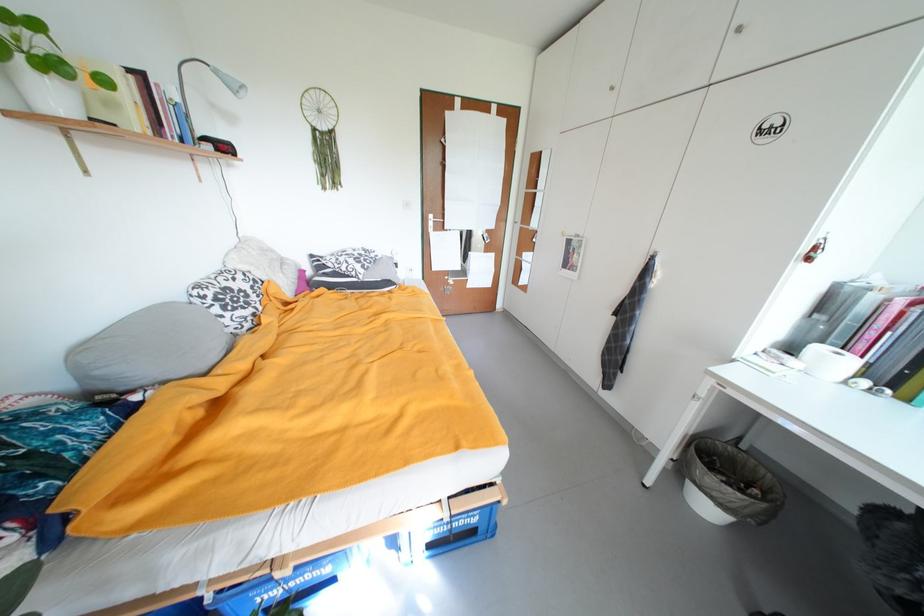
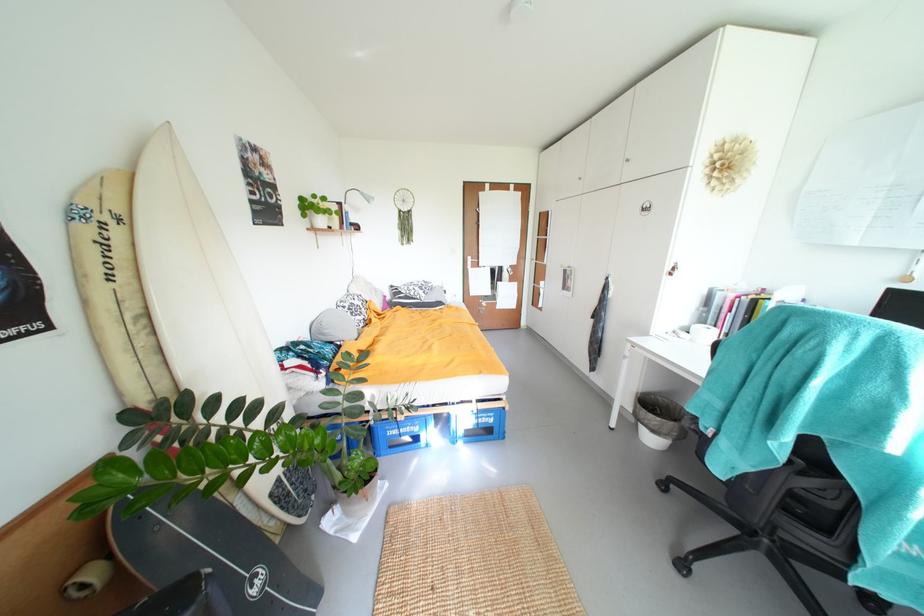
The point at (811,251) is marked in the first image. Where is the corresponding point in the second image?

(675, 270)